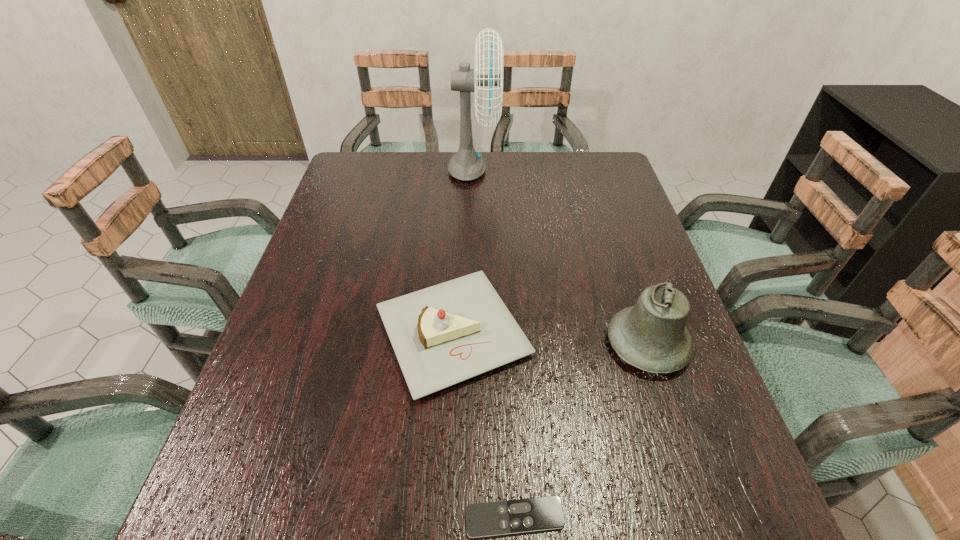
This screenshot has width=960, height=540. What are the coordinates of `unoccupied position between the rightmost object and the fan` in the screenshot? It's located at (561, 258).

Find the location of `vacant area that lies between the bell and the remote control`. vacant area that lies between the bell and the remote control is located at coordinates (581, 430).

The height and width of the screenshot is (540, 960). What are the coordinates of `free spot between the tallest object and the bell` in the screenshot? It's located at (561, 258).

Where is `free spot between the farthest object and the third shortest object`? The image size is (960, 540). free spot between the farthest object and the third shortest object is located at coordinates (561, 258).

Image resolution: width=960 pixels, height=540 pixels. Identify the location of free area in between the cake and the bell. (550, 338).

This screenshot has width=960, height=540. I want to click on empty location between the third tallest object and the second tallest object, so click(550, 338).

At what (x,y) coordinates should I click in order to perform the action: click on free point between the tallest object and the cake. Please return your answer as a coordinate pair (x, y). Looking at the image, I should click on (463, 252).

I want to click on free space between the rightmost object and the shortest object, so click(581, 430).

Locate which object ranks second in proximity to the cake. Please provide its 2D coordinates. Your answer should be formatted as a tuple, i.e. [(x, y)], where the tuple contains the x and y coordinates of a point satisfying the conditions above.

[(541, 513)]

Select which object appears as the third closest to the shortest object. Please provide its 2D coordinates. Your answer should be formatted as a tuple, i.e. [(x, y)], where the tuple contains the x and y coordinates of a point satisfying the conditions above.

[(466, 165)]